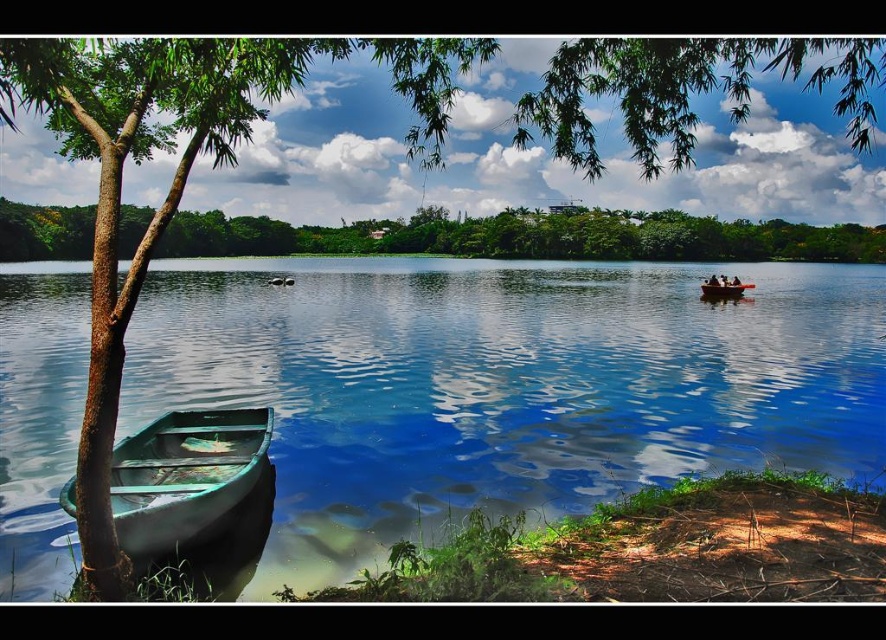
You are standing on the lakeside and see the green matte boat at lower left and the green wooden boat at lower left. Which boat has a higher height?

The green matte boat at lower left is taller than the green wooden boat at lower left, so the green matte boat at lower left has a higher height.